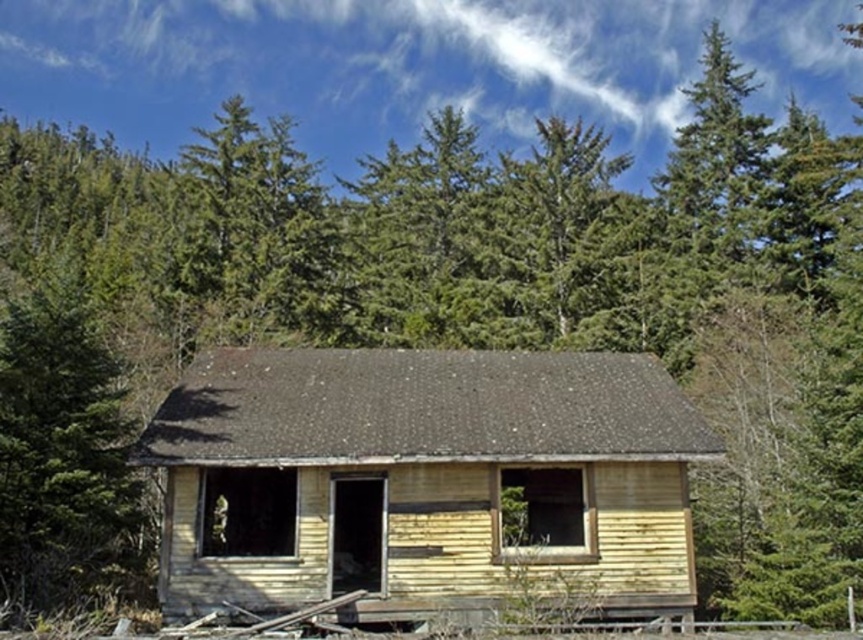
You are a hiker lost in the forest and see the yellow wood cabin at center and the green textured tree at left. Which one is closer to your left side?

The green textured tree at left is closer to your left side since it is positioned to the left of the yellow wood cabin at center.

You are a hiker who wants to take a photo of the yellow wood cabin at center and the green textured tree at left from a distance. Which object will appear smaller in your photo?

The yellow wood cabin at center will appear smaller in the photo because it is shorter than the green textured tree at left, but since they are both at a distance, their apparent size also depends on their actual sizes and distances from the camera. However, based on the given information that the cabin is shorter, if they are equidistant, the cabin would naturally be smaller.

You are standing in front of the abandoned wooden house and want to place a small garden between the two points marked as point [372,432] and point [79,548]. Which point should you start planting the garden closer to if you want the garden to be closer to the camera?

You should start planting the garden closer to point [372,432] because it is further to the camera than point [79,548].